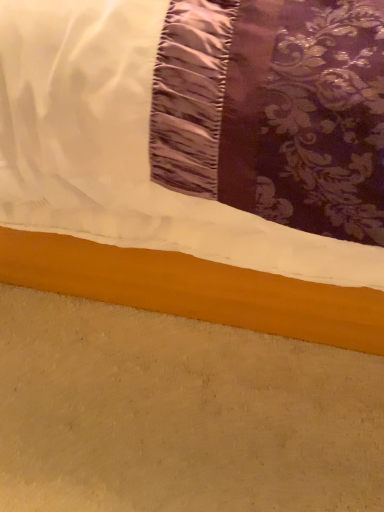
You are a GUI agent. You are given a task and a screenshot of the screen. Output one action in this format:
    pyautogui.click(x=<x>, y=<y>)
    Task: Click on the white satin bed at upper center
    The height and width of the screenshot is (512, 384).
    Given the screenshot: What is the action you would take?
    pyautogui.click(x=199, y=159)

What do you see at coordinates (199, 159) in the screenshot?
I see `white satin bed at upper center` at bounding box center [199, 159].

This screenshot has height=512, width=384. What are the coordinates of `white satin bed at upper center` in the screenshot? It's located at (199, 159).